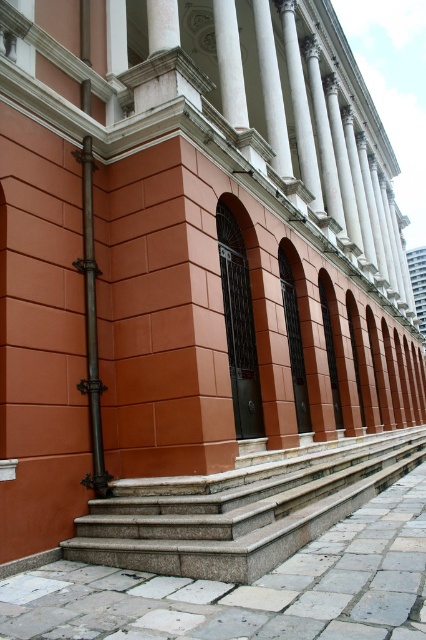
Question: Is granite steps at lower center positioned before white marble pillar at upper center?

Choices:
 (A) yes
 (B) no

Answer: (A)

Question: Can you confirm if granite steps at lower center is positioned above white marble pillar at upper center?

Choices:
 (A) no
 (B) yes

Answer: (A)

Question: Does granite steps at lower center appear on the right side of white marble pillar at upper center?

Choices:
 (A) yes
 (B) no

Answer: (A)

Question: Among these objects, which one is farthest from the camera?

Choices:
 (A) white marble pillar at upper center
 (B) granite steps at lower center

Answer: (A)

Question: Which point appears farthest from the camera in this image?

Choices:
 (A) (216, 48)
 (B) (397, 474)

Answer: (A)

Question: Which point is farther to the camera?

Choices:
 (A) white marble pillar at upper center
 (B) granite steps at lower center

Answer: (A)